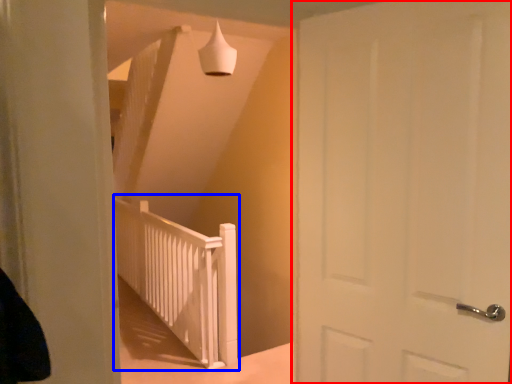
Question: Which object is further to the camera taking this photo, door (highlighted by a red box) or rail (highlighted by a blue box)?

Choices:
 (A) door
 (B) rail

Answer: (B)